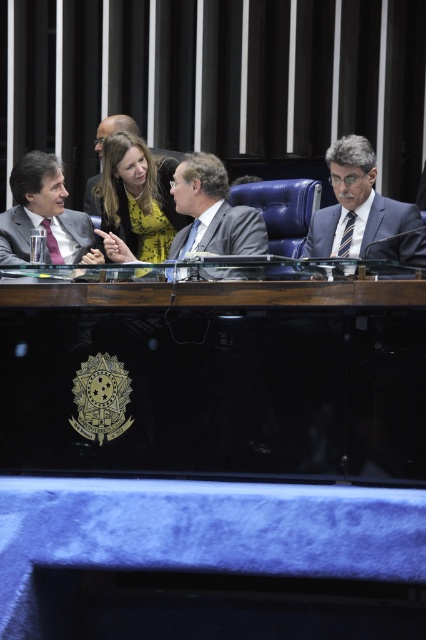
You are an attendee in the assembly and want to determine the relative positions of two points on the table. Given that you are facing the table, which point is closer to you, point (192, 214) or point (14, 216)?

Point (192, 214) is closer to the viewer than point (14, 216).